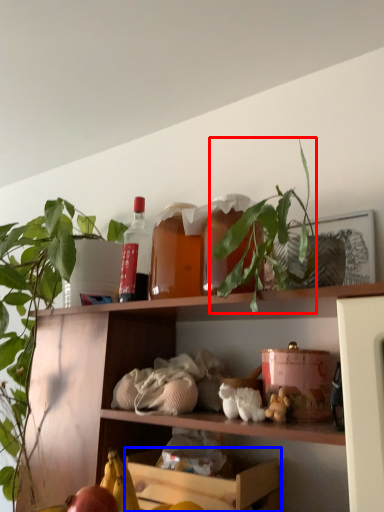
Question: Which object is further to the camera taking this photo, plant (highlighted by a red box) or shelf (highlighted by a blue box)?

Choices:
 (A) plant
 (B) shelf

Answer: (B)